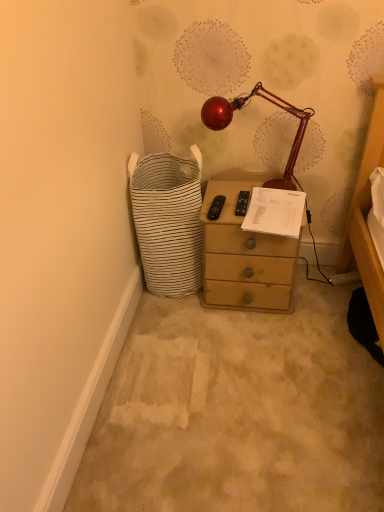
In order to face white striped fabric basket at lower left, should I rotate leftwards or rightwards?

Turn left approximately 3.113 degrees to face it.

Measure the distance between point [220,121] and camera.

The distance of point [220,121] from camera is 1.63 meters.

What is the approximate width of wooden drawer at center?

wooden drawer at center is 4.40 feet wide.

Where is `white striped fabric basket at lower left`? white striped fabric basket at lower left is located at coordinates (168, 221).

From the image's perspective, which object appears higher, wooden drawer at center or white striped fabric basket at lower left?

white striped fabric basket at lower left, from the image's perspective.

Is wooden drawer at center completely or partially outside of white striped fabric basket at lower left?

Indeed, wooden drawer at center is completely outside white striped fabric basket at lower left.

Which point is more forward, [303,292] or [171,167]?

The point [303,292] is more forward.

Which object is further away from the camera taking this photo, wooden drawer at center or white striped fabric basket at lower left?

white striped fabric basket at lower left is more distant.

Is wooden drawer at center with glossy red lamp at upper center?

No, wooden drawer at center is not making contact with glossy red lamp at upper center.

How far apart are wooden drawer at center and glossy red lamp at upper center?

They are 36.15 inches apart.

Which is further, (179,492) or (210,126)?

Point (210,126)

Is wooden drawer at center oriented towards glossy red lamp at upper center?

No, wooden drawer at center is not turned towards glossy red lamp at upper center.

Between matte brown chest of drawers at center and glossy red lamp at upper center, which one has more height?

matte brown chest of drawers at center is taller.

From a real-world perspective, does matte brown chest of drawers at center sit lower than glossy red lamp at upper center?

Indeed, from a real-world perspective, matte brown chest of drawers at center is positioned beneath glossy red lamp at upper center.

From the image's perspective, does matte brown chest of drawers at center appear lower than glossy red lamp at upper center?

Yes, from the image's perspective, matte brown chest of drawers at center is beneath glossy red lamp at upper center.

Considering the positions of objects matte brown chest of drawers at center and glossy red lamp at upper center in the image provided, who is more to the left, matte brown chest of drawers at center or glossy red lamp at upper center?

From the viewer's perspective, glossy red lamp at upper center appears more on the left side.

Looking at this image, from the image's perspective, is glossy red lamp at upper center above or below wooden drawer at center?

glossy red lamp at upper center is above wooden drawer at center.

From a real-world perspective, which object rests below the other?

In real-world perspective, wooden drawer at center is lower.

Considering the positions of point (220, 100) and point (295, 343), is point (220, 100) closer or farther from the camera than point (295, 343)?

Point (220, 100) is closer to the camera than point (295, 343).

In terms of size, does glossy red lamp at upper center appear bigger or smaller than wooden drawer at center?

Clearly, glossy red lamp at upper center is smaller in size than wooden drawer at center.

Is matte brown chest of drawers at center taller than white striped fabric basket at lower left?

In fact, matte brown chest of drawers at center may be shorter than white striped fabric basket at lower left.

From the image's perspective, is matte brown chest of drawers at center located beneath white striped fabric basket at lower left?

Yes, from the image's perspective, matte brown chest of drawers at center is below white striped fabric basket at lower left.

Is matte brown chest of drawers at center turned away from white striped fabric basket at lower left?

matte brown chest of drawers at center does not have its back to white striped fabric basket at lower left.

Does matte brown chest of drawers at center touch white striped fabric basket at lower left?

matte brown chest of drawers at center and white striped fabric basket at lower left are clearly separated.

Does glossy red lamp at upper center have a smaller size compared to white striped fabric basket at lower left?

Indeed, glossy red lamp at upper center has a smaller size compared to white striped fabric basket at lower left.

Between point (293, 187) and point (149, 194), which one is positioned behind?

Positioned behind is point (293, 187).

Would you say white striped fabric basket at lower left is part of glossy red lamp at upper center's contents?

No, white striped fabric basket at lower left is not a part of glossy red lamp at upper center.

Considering the positions of objects glossy red lamp at upper center and white striped fabric basket at lower left in the image provided, who is in front, glossy red lamp at upper center or white striped fabric basket at lower left?

white striped fabric basket at lower left is in front.

From the image's perspective, between white striped fabric basket at lower left and matte brown chest of drawers at center, which one is located above?

white striped fabric basket at lower left is shown above in the image.

Considering the relative sizes of white striped fabric basket at lower left and matte brown chest of drawers at center in the image provided, is white striped fabric basket at lower left bigger than matte brown chest of drawers at center?

Indeed, white striped fabric basket at lower left has a larger size compared to matte brown chest of drawers at center.

Looking at this image, is white striped fabric basket at lower left turned away from matte brown chest of drawers at center?

No, white striped fabric basket at lower left is not facing away from matte brown chest of drawers at center.

Find the location of a particular element. The image size is (384, 512). concrete located underneath the white striped fabric basket at lower left (from a real-world perspective) is located at coordinates (238, 412).

At what (x,y) coordinates should I click in order to perform the action: click on lamp located above the wooden drawer at center (from a real-world perspective). Please return your answer as a coordinate pair (x, y). Looking at the image, I should click on (241, 106).

Looking at the image, which one is located further to wooden drawer at center, glossy red lamp at upper center or matte brown chest of drawers at center?

glossy red lamp at upper center lies further to wooden drawer at center than the other object.

Considering their positions, is white striped fabric basket at lower left positioned further to wooden drawer at center than glossy red lamp at upper center?

glossy red lamp at upper center is positioned further to the anchor wooden drawer at center.

Estimate the real-world distances between objects in this image. Which object is closer to glossy red lamp at upper center, wooden drawer at center or white striped fabric basket at lower left?

Among the two, white striped fabric basket at lower left is located nearer to glossy red lamp at upper center.

In the scene shown: Considering their positions, is white striped fabric basket at lower left positioned further to wooden drawer at center than matte brown chest of drawers at center?

Among the two, white striped fabric basket at lower left is located further to wooden drawer at center.

Considering their positions, is matte brown chest of drawers at center positioned closer to wooden drawer at center than glossy red lamp at upper center?

matte brown chest of drawers at center.

From the image, which object appears to be farther from matte brown chest of drawers at center, wooden drawer at center or white striped fabric basket at lower left?

The object further to matte brown chest of drawers at center is wooden drawer at center.

When comparing their distances from white striped fabric basket at lower left, does matte brown chest of drawers at center or glossy red lamp at upper center seem closer?

matte brown chest of drawers at center is closer to white striped fabric basket at lower left.

Considering their positions, is glossy red lamp at upper center positioned further to wooden drawer at center than white striped fabric basket at lower left?

The object further to wooden drawer at center is glossy red lamp at upper center.

In order to click on chest of drawers between glossy red lamp at upper center and wooden drawer at center in the vertical direction in this screenshot , I will do `click(244, 252)`.

Where is `the chest of drawers between white striped fabric basket at lower left and wooden drawer at center vertically`? This screenshot has height=512, width=384. the chest of drawers between white striped fabric basket at lower left and wooden drawer at center vertically is located at coordinates (244, 252).

Where is `shopping basket between glossy red lamp at upper center and wooden drawer at center in the vertical direction`? The height and width of the screenshot is (512, 384). shopping basket between glossy red lamp at upper center and wooden drawer at center in the vertical direction is located at coordinates (168, 221).

The image size is (384, 512). What are the coordinates of `shopping basket between glossy red lamp at upper center and matte brown chest of drawers at center in the vertical direction` in the screenshot? It's located at pyautogui.click(x=168, y=221).